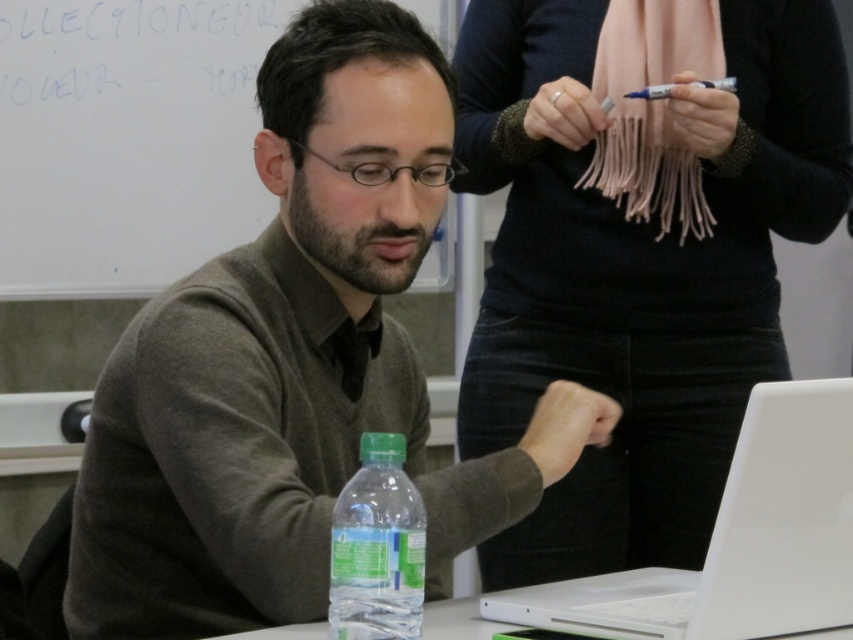
Consider the image. Who is more distant from viewer, (x=268, y=26) or (x=631, y=588)?

The point (x=268, y=26) is behind.

Can you confirm if whiteboard at upper left is positioned to the left of white glossy laptop at lower right?

Yes, whiteboard at upper left is to the left of white glossy laptop at lower right.

Which is behind, point (39, 156) or point (730, 502)?

The point (39, 156) is more distant.

I want to click on whiteboard at upper left, so click(126, 140).

Who is more distant from viewer, (457, 147) or (346, 547)?

Point (457, 147)

Is point (462, 26) positioned in front of point (410, 525)?

No, it is behind (410, 525).

Which is behind, point (544, 337) or point (345, 570)?

Point (544, 337)

Find the location of a particular element. pink fabric scarf at upper center is located at coordinates pos(636,264).

Who is more forward, (194, 337) or (544, 602)?

Point (194, 337) is more forward.

Does matte gray sweater at center have a lesser height compared to white glossy laptop at lower right?

Incorrect, matte gray sweater at center's height does not fall short of white glossy laptop at lower right's.

I want to click on matte gray sweater at center, so 294,362.